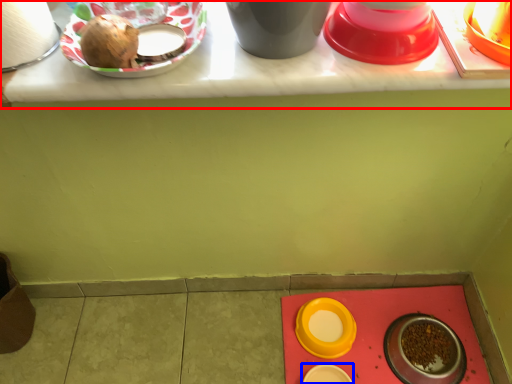
Question: Which object is further to the camera taking this photo, table (highlighted by a red box) or tableware (highlighted by a blue box)?

Choices:
 (A) table
 (B) tableware

Answer: (B)